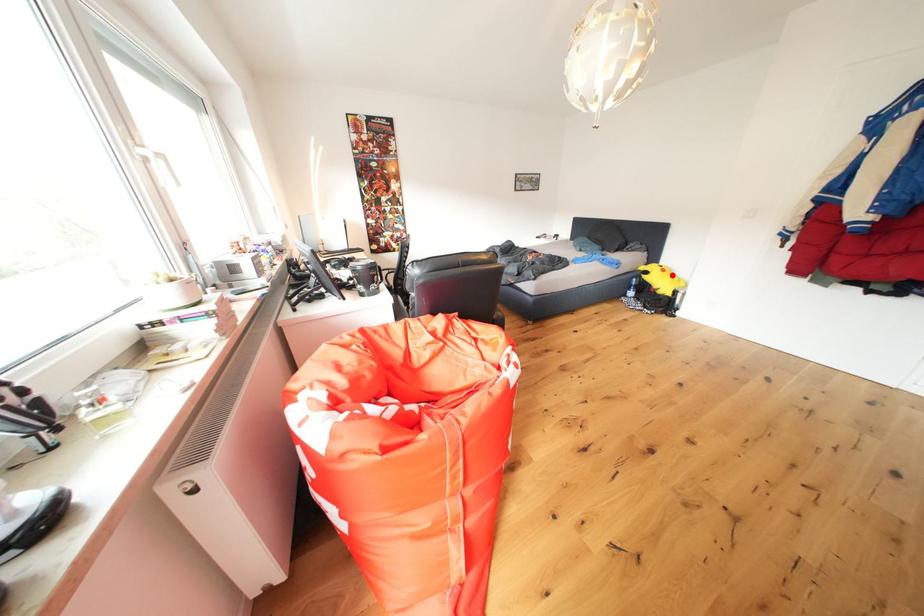
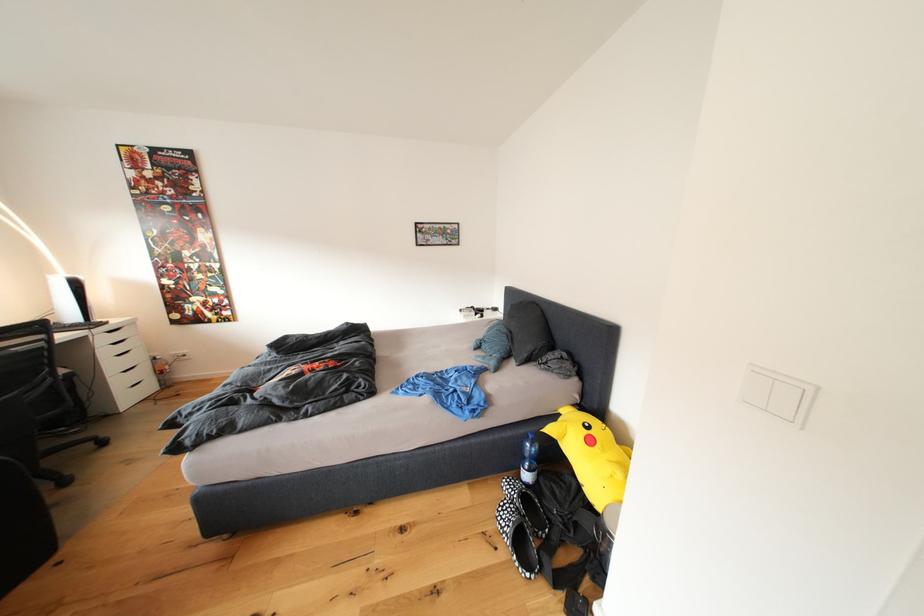
Where in the second image is the point corresponding to the highlighted location from the first image?

(600, 446)